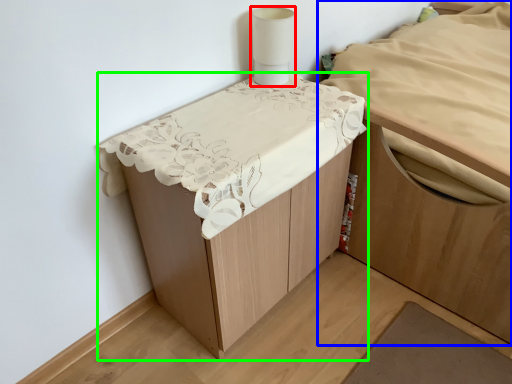
Question: Which is nearer to the lamp (highlighted by a red box)? furniture (highlighted by a blue box) or furniture (highlighted by a green box).

Choices:
 (A) furniture
 (B) furniture

Answer: (B)